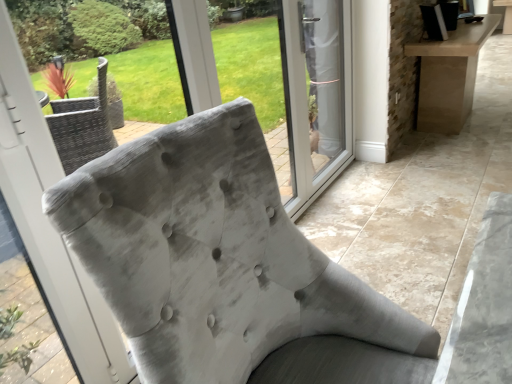
At what (x,y) coordinates should I click in order to perform the action: click on vacant area located to the right-hand side of transparent glass door at center. Please return your answer as a coordinate pair (x, y). Looking at the image, I should click on (362, 175).